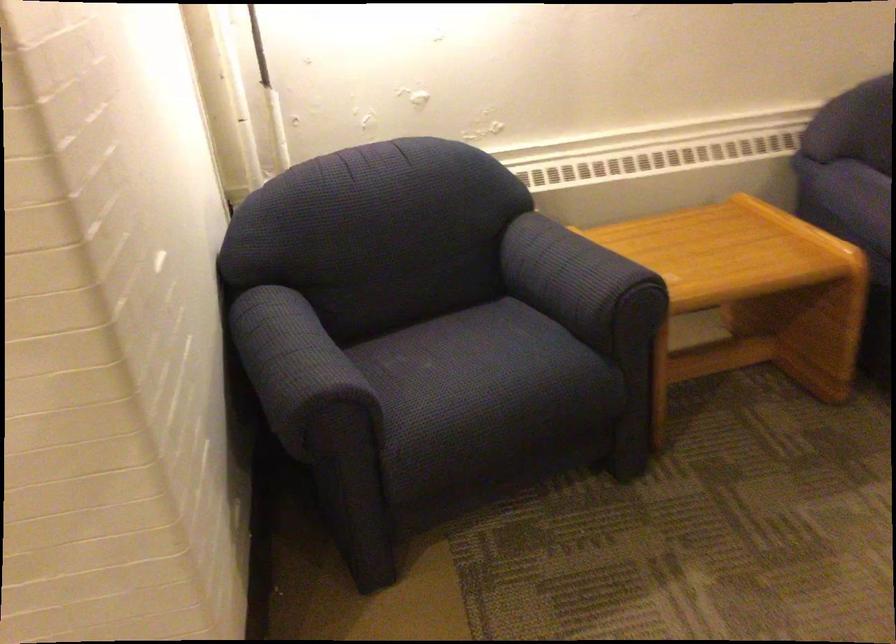
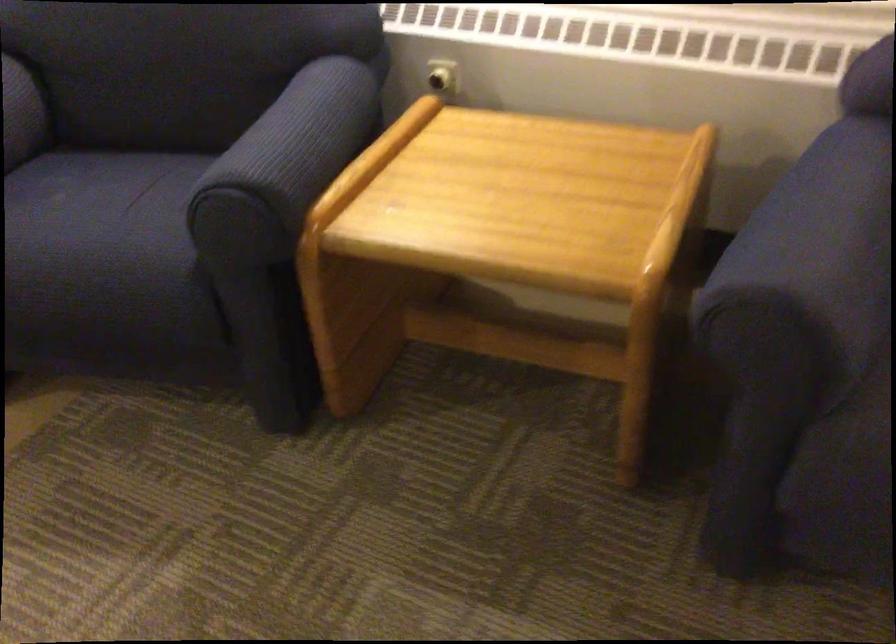
Where in the second image is the point corresponding to point 504,364 from the first image?

(99, 232)